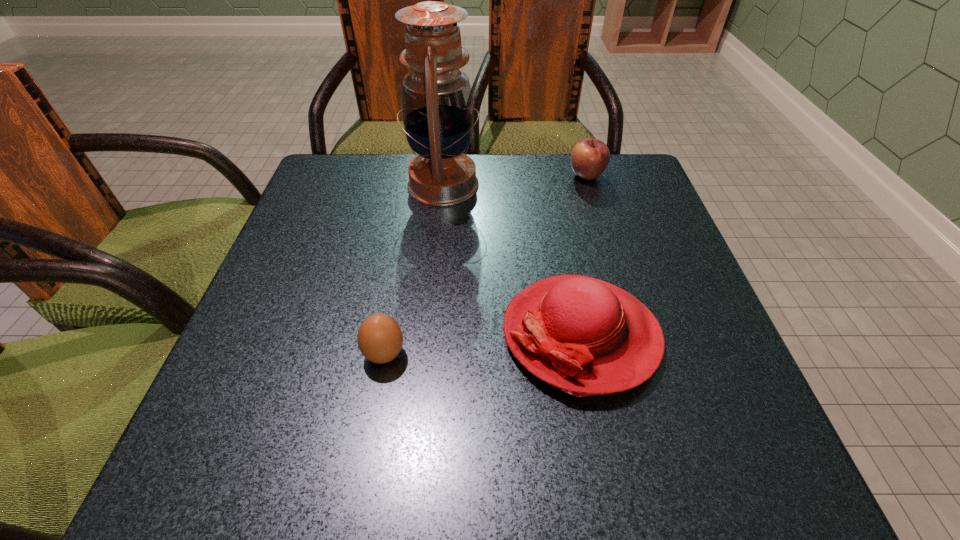
Find the location of `vacant area between the hat and the tallest object`. vacant area between the hat and the tallest object is located at coordinates (512, 260).

Image resolution: width=960 pixels, height=540 pixels. I want to click on free spot between the oil lamp and the hat, so click(512, 260).

What are the coordinates of `free space between the hat and the apple` in the screenshot? It's located at (584, 255).

The height and width of the screenshot is (540, 960). In order to click on empty space that is in between the shortest object and the hat in this screenshot , I will do `click(483, 345)`.

Locate an element on the screen. The width and height of the screenshot is (960, 540). vacant region between the hat and the boiled egg is located at coordinates (483, 345).

This screenshot has height=540, width=960. Find the location of `free space between the shortest object and the apple`. free space between the shortest object and the apple is located at coordinates (486, 265).

At what (x,y) coordinates should I click in order to perform the action: click on vacant space in between the apple and the shortest object. Please return your answer as a coordinate pair (x, y). Looking at the image, I should click on (486, 265).

At what (x,y) coordinates should I click in order to perform the action: click on free space between the shortest object and the hat. Please return your answer as a coordinate pair (x, y). This screenshot has height=540, width=960. Looking at the image, I should click on (483, 345).

What are the coordinates of `unoccupied area between the oil lamp and the hat` in the screenshot? It's located at (512, 260).

Identify which object is the third nearest to the boiled egg. Please provide its 2D coordinates. Your answer should be formatted as a tuple, i.e. [(x, y)], where the tuple contains the x and y coordinates of a point satisfying the conditions above.

[(589, 158)]